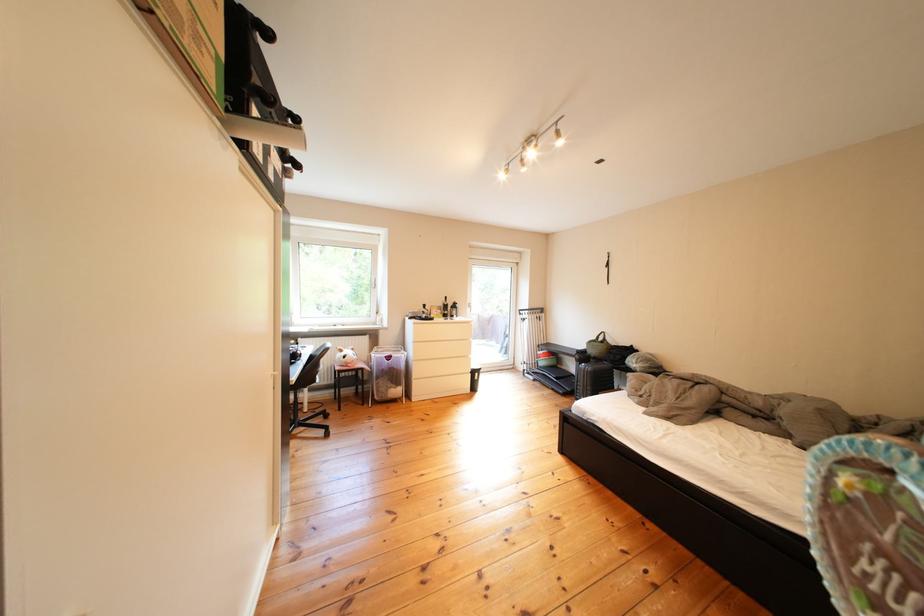
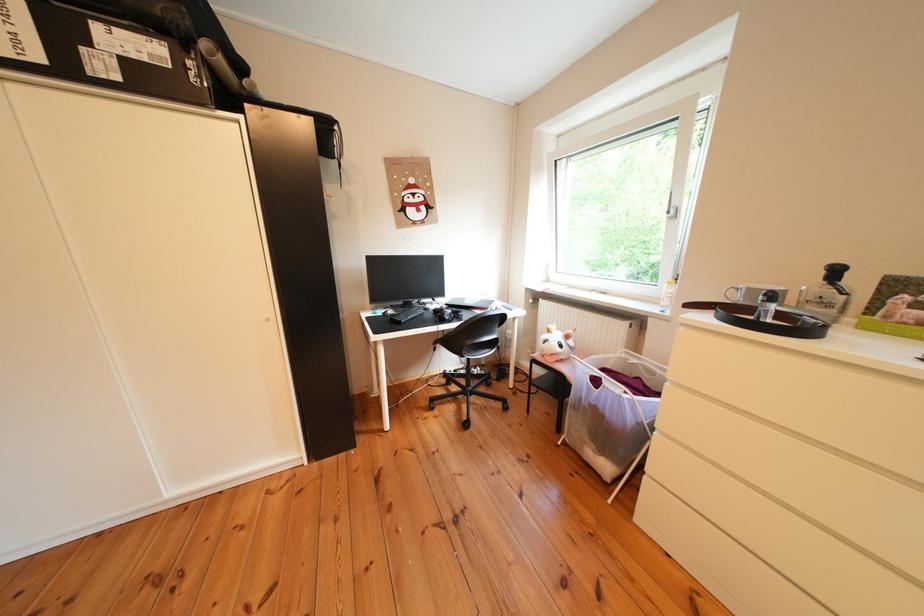
Locate, in the second image, the point that corresponds to point (404, 390) in the first image.

(601, 442)